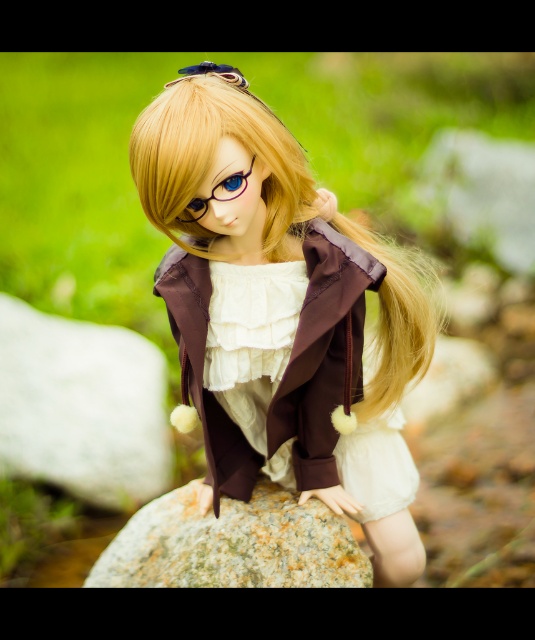
Question: Which object is closer to the camera taking this photo?

Choices:
 (A) matte brown jacket at center
 (B) white satin dress at center
 (C) matte brown hair at center

Answer: (C)

Question: Among these objects, which one is farthest from the camera?

Choices:
 (A) matte brown hair at center
 (B) white satin dress at center
 (C) green speckled rock at center

Answer: (C)

Question: Can you confirm if matte brown jacket at center is positioned below white satin dress at center?

Choices:
 (A) yes
 (B) no

Answer: (B)

Question: Which of the following is the farthest from the observer?

Choices:
 (A) matte brown hair at center
 (B) matte brown jacket at center

Answer: (B)

Question: Is matte brown jacket at center in front of white satin dress at center?

Choices:
 (A) yes
 (B) no

Answer: (A)

Question: Can you confirm if matte brown jacket at center is positioned below matte brown hair at center?

Choices:
 (A) no
 (B) yes

Answer: (B)